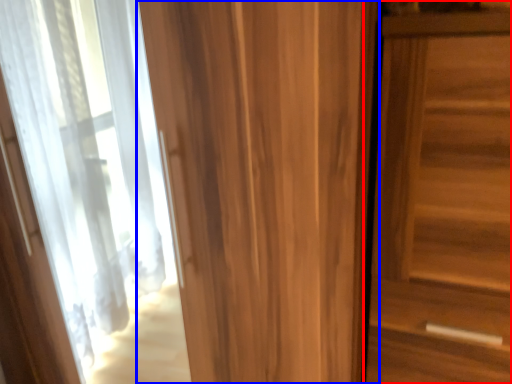
Question: Which object appears farthest to the camera in this image, door (highlighted by a red box) or door (highlighted by a blue box)?

Choices:
 (A) door
 (B) door

Answer: (A)